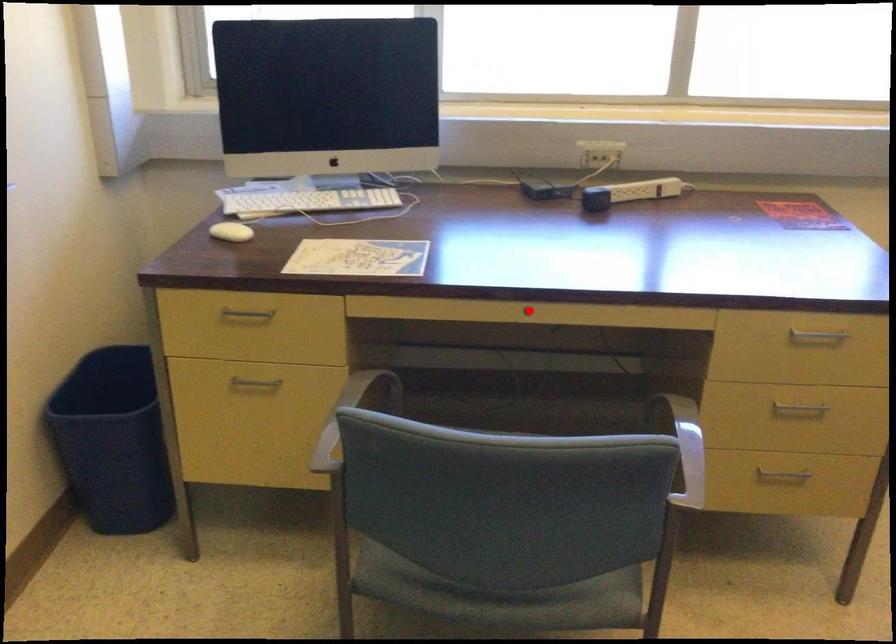
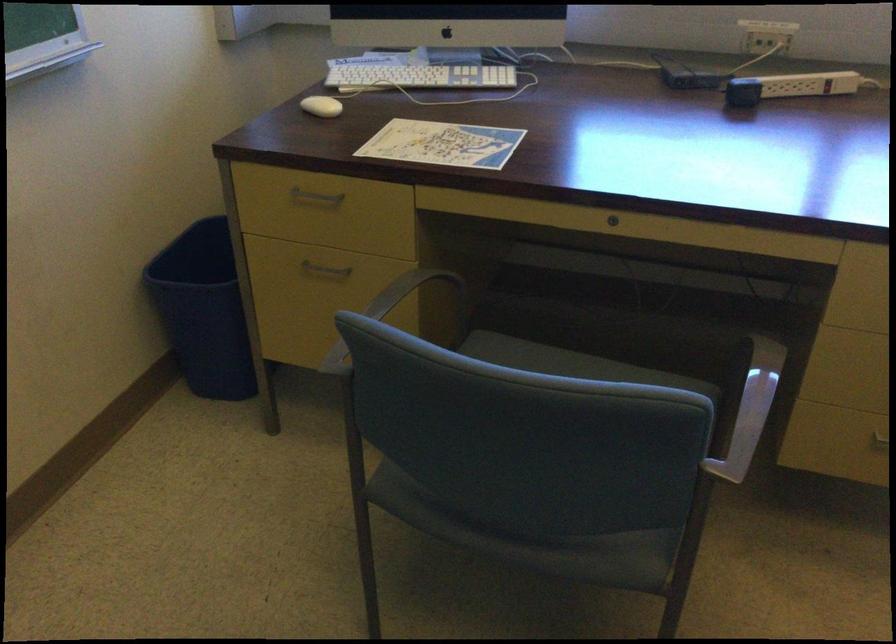
Question: A red point is marked in image1. In image2, is the corresponding 3D point closer to the camera or farther? Reply with the corresponding letter.

Choices:
 (A) The corresponding 3D point is closer.
 (B) The corresponding 3D point is farther.

Answer: (A)